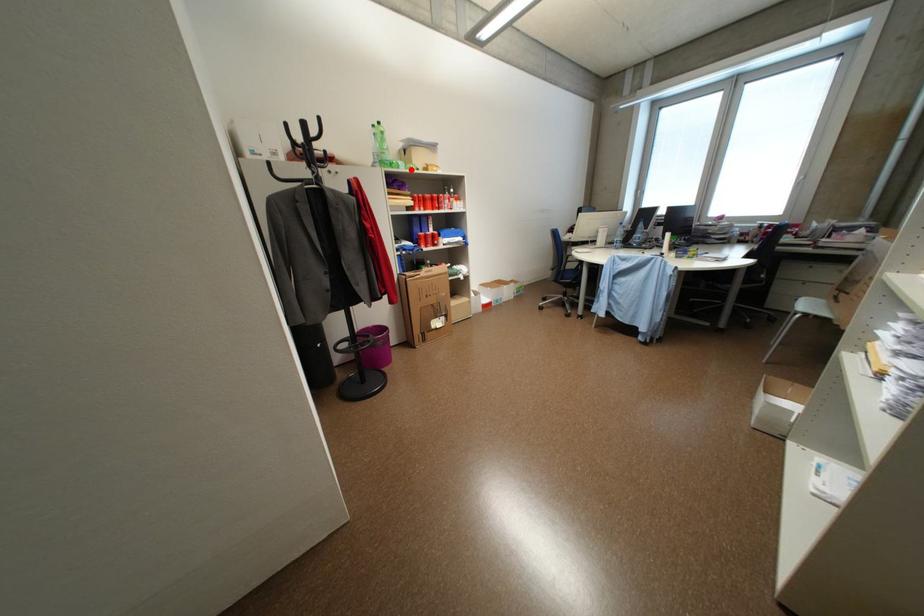
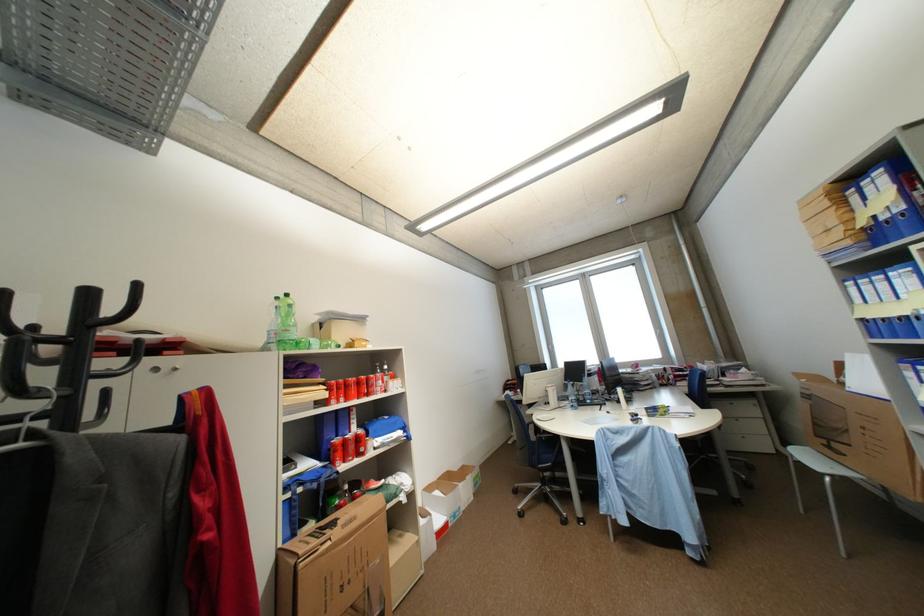
In the second image, find the point that corresponds to the highlighted location in the first image.

(323, 349)